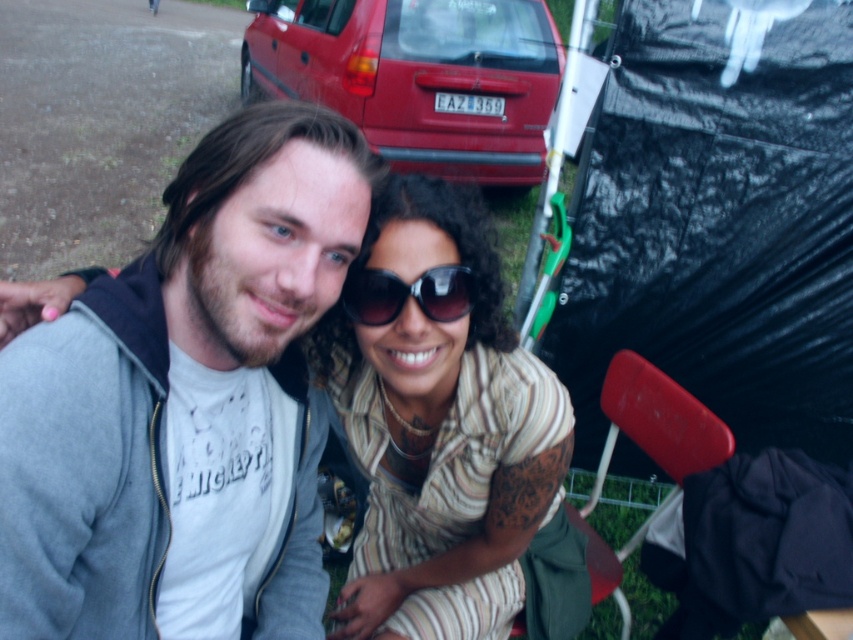
You are trying to determine if the gray fleece jacket at center can fit inside the trunk of the matte red car at upper center. Based on their widths, can the jacket fit?

The gray fleece jacket at center has a lesser width compared to matte red car at upper center. Since the jacket is narrower, it should fit inside the trunk as long as the length and height also accommodate it.

You are standing in the scene and see the point at coordinates [718,220]. What object is this point located on?

The point at coordinates [718,220] is located on the black plastic tent at right.